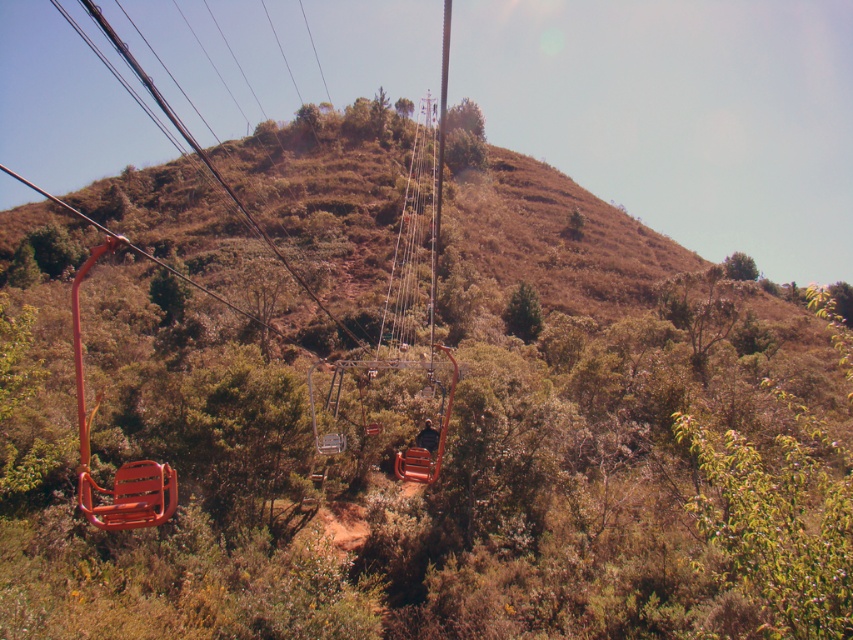
You are a bird flying over the mountain landscape and want to land on a higher object between the orange plastic power line at left and the metallic wire at left. Which one should you choose?

The orange plastic power line at left is much taller than the metallic wire at left, so you should choose the orange plastic power line at left to land on.

You are standing at the point marked by the orange plastic power line at left located at point (x=206, y=157). You want to walk to the nearest chairlift seat. Which direction should you go?

The orange plastic power line at left is located at point (x=206, y=157). To reach the nearest chairlift seat, you should head towards the direction where the chairlift seats are suspended, which are in the foreground of the image. Since the power line is at the left point, moving towards the center or right would lead you closer to the chairlift seats.